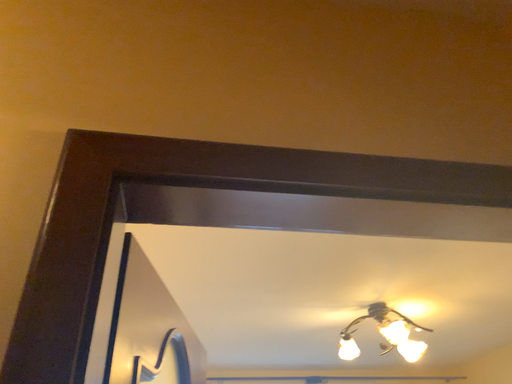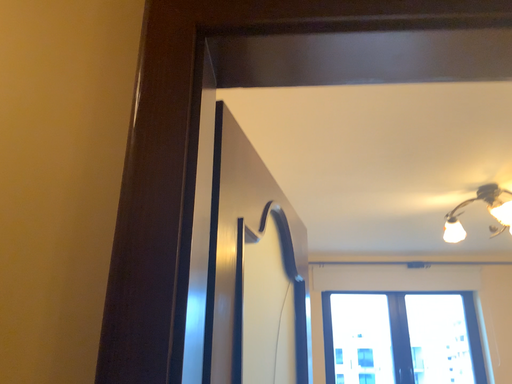
Question: How did the camera likely rotate when shooting the video?

Choices:
 (A) rotated downward
 (B) rotated upward

Answer: (A)